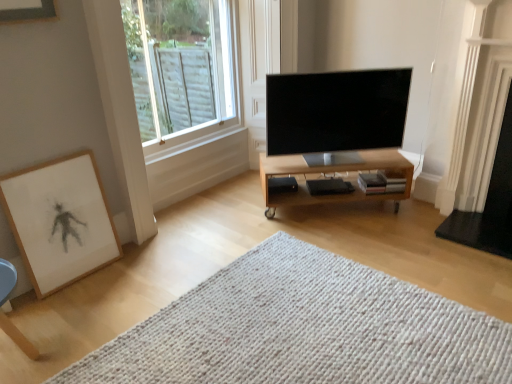
Question: Considering the relative sizes of light wood/finished table at center and clear glass window at upper left in the image provided, is light wood/finished table at center wider than clear glass window at upper left?

Choices:
 (A) no
 (B) yes

Answer: (B)

Question: Would you say clear glass window at upper left is part of light wood/finished table at center's contents?

Choices:
 (A) yes
 (B) no

Answer: (B)

Question: Does light wood/finished table at center lie in front of clear glass window at upper left?

Choices:
 (A) no
 (B) yes

Answer: (A)

Question: Could you tell me if light wood/finished table at center is facing clear glass window at upper left?

Choices:
 (A) yes
 (B) no

Answer: (B)

Question: Is light wood/finished table at center to the left of clear glass window at upper left from the viewer's perspective?

Choices:
 (A) no
 (B) yes

Answer: (A)

Question: Considering the relative positions of light wood/finished table at center and clear glass window at upper left in the image provided, is light wood/finished table at center to the right of clear glass window at upper left from the viewer's perspective?

Choices:
 (A) no
 (B) yes

Answer: (B)

Question: Can you confirm if white knitted mat at center is positioned to the left of white glossy fireplace at right?

Choices:
 (A) no
 (B) yes

Answer: (B)

Question: Is white knitted mat at center further to the viewer compared to white glossy fireplace at right?

Choices:
 (A) no
 (B) yes

Answer: (A)

Question: Could you tell me if white knitted mat at center is facing white glossy fireplace at right?

Choices:
 (A) no
 (B) yes

Answer: (A)

Question: Considering the relative sizes of white knitted mat at center and white glossy fireplace at right in the image provided, is white knitted mat at center wider than white glossy fireplace at right?

Choices:
 (A) yes
 (B) no

Answer: (A)

Question: From the image's perspective, does white knitted mat at center appear lower than white glossy fireplace at right?

Choices:
 (A) yes
 (B) no

Answer: (A)

Question: Can you confirm if white knitted mat at center is bigger than white glossy fireplace at right?

Choices:
 (A) no
 (B) yes

Answer: (B)

Question: Does light wood/finished table at center lie in front of wooden framed artwork at lower left?

Choices:
 (A) no
 (B) yes

Answer: (A)